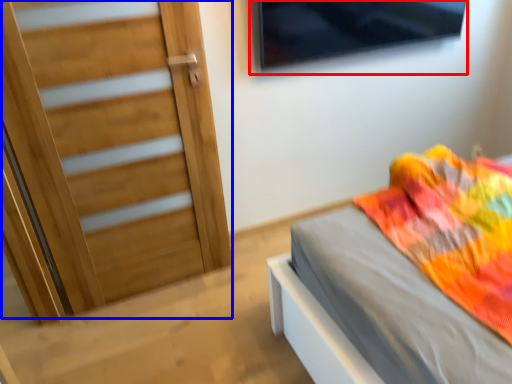
Question: Which of the following is the farthest to the observer, window (highlighted by a red box) or door (highlighted by a blue box)?

Choices:
 (A) window
 (B) door

Answer: (A)